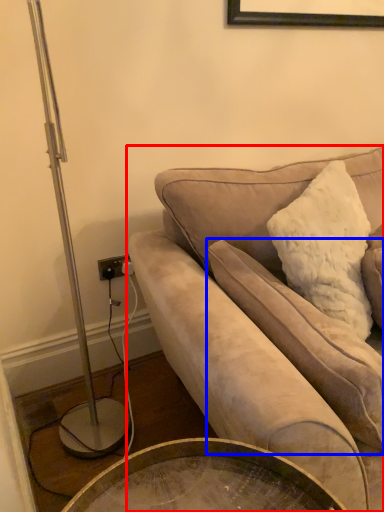
Question: Which object appears farthest to the camera in this image, studio couch (highlighted by a red box) or pillow (highlighted by a blue box)?

Choices:
 (A) studio couch
 (B) pillow

Answer: (B)